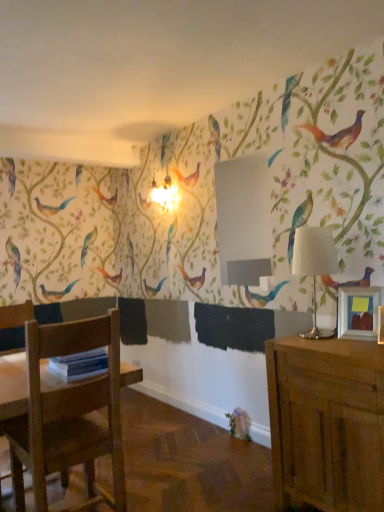
The width and height of the screenshot is (384, 512). I want to click on white fabric lampshade at right, so click(x=314, y=265).

You are a GUI agent. You are given a task and a screenshot of the screen. Output one action in this format:
    pyautogui.click(x=<x>, y=<y>)
    Task: Click on the wooden cabinet at right
    Image resolution: width=384 pixels, height=512 pixels.
    Given the screenshot: What is the action you would take?
    pyautogui.click(x=327, y=422)

Identify the location of wooden picture frame at right. The height and width of the screenshot is (512, 384). (358, 312).

Considering the sizes of wooden cabinet at right and wooden chair at lower left in the image, is wooden cabinet at right wider or thinner than wooden chair at lower left?

Considering their sizes, wooden cabinet at right looks slimmer than wooden chair at lower left.

Is wooden cabinet at right positioned far away from wooden chair at lower left?

wooden cabinet at right is far away from wooden chair at lower left.

The height and width of the screenshot is (512, 384). Identify the location of chair located behind the wooden cabinet at right. (16, 315).

Considering the sizes of objects wooden cabinet at right and wooden chair at lower left in the image provided, who is shorter, wooden cabinet at right or wooden chair at lower left?

wooden cabinet at right is shorter.

Is wooden chair at lower left taller than white fabric lampshade at right?

Correct, wooden chair at lower left is much taller as white fabric lampshade at right.

Identify the location of lamp positioned vertically above the wooden chair at lower left (from a real-world perspective). (314, 265).

From the image's perspective, which is above, wooden chair at lower left or white fabric lampshade at right?

white fabric lampshade at right appears higher in the image.

Is wooden chair at lower left outside of white fabric lampshade at right?

That's correct, wooden chair at lower left is outside of white fabric lampshade at right.

Does wooden picture frame at right have a lesser width compared to wooden chair at lower left?

Yes.

From the picture: Considering the sizes of objects wooden picture frame at right and wooden chair at lower left in the image provided, who is bigger, wooden picture frame at right or wooden chair at lower left?

With larger size is wooden chair at lower left.

How many degrees apart are the facing directions of wooden picture frame at right and wooden chair at lower left?

wooden picture frame at right and wooden chair at lower left are facing 107 degrees away from each other.

Find the location of a particular element. The image size is (384, 512). chair below the wooden picture frame at right (from a real-world perspective) is located at coordinates (16, 315).

Consider the image. Does wooden picture frame at right contain wooden cabinet at right?

No.

Is wooden picture frame at right oriented towards wooden cabinet at right?

No, wooden picture frame at right does not turn towards wooden cabinet at right.

Who is bigger, wooden picture frame at right or wooden cabinet at right?

wooden cabinet at right is bigger.

Considering the positions of point (374, 333) and point (347, 481), is point (374, 333) closer or farther from the camera than point (347, 481)?

Point (374, 333).

From a real-world perspective, is white fabric lampshade at right beneath wooden picture frame at right?

No, from a real-world perspective, white fabric lampshade at right is not under wooden picture frame at right.

Based on their positions, is white fabric lampshade at right located to the left or right of wooden picture frame at right?

white fabric lampshade at right is to the left of wooden picture frame at right.

Does point (306, 249) appear closer or farther from the camera than point (359, 293)?

Point (306, 249).

Does white fabric lampshade at right have a larger size compared to wooden chair at lower left?

Actually, white fabric lampshade at right might be smaller than wooden chair at lower left.

From the image's perspective, is white fabric lampshade at right positioned above or below wooden chair at lower left?

white fabric lampshade at right is situated higher than wooden chair at lower left in the image.

Can you tell me how much white fabric lampshade at right and wooden chair at lower left differ in facing direction?

92.3 degrees separate the facing orientations of white fabric lampshade at right and wooden chair at lower left.

Are white fabric lampshade at right and wooden chair at lower left far apart?

That's right, there is a large distance between white fabric lampshade at right and wooden chair at lower left.

Is wooden chair at lower left not within wooden cabinet at right?

Yes.

Which object is closer to the camera, wooden chair at lower left or wooden cabinet at right?

wooden cabinet at right is in front.

Where is `cabinetry in front of the wooden chair at lower left`? This screenshot has height=512, width=384. cabinetry in front of the wooden chair at lower left is located at coordinates (327, 422).

Is wooden chair at lower left positioned with its back to wooden cabinet at right?

That's not correct — wooden chair at lower left is not looking away from wooden cabinet at right.

This screenshot has height=512, width=384. In order to click on cabinetry lying on the right of wooden chair at lower left in this screenshot , I will do `click(327, 422)`.

Identify the location of lamp behind the wooden chair at lower left. (314, 265).

Estimate the real-world distances between objects in this image. Which object is further from white fabric lampshade at right, wooden chair at lower left or wooden picture frame at right?

wooden chair at lower left is positioned further to the anchor white fabric lampshade at right.

Looking at the image, which one is located closer to wooden picture frame at right, wooden chair at lower left or white fabric lampshade at right?

white fabric lampshade at right is closer to wooden picture frame at right.

Consider the image. Which object lies nearer to the anchor point white fabric lampshade at right, wooden cabinet at right or wooden picture frame at right?

wooden picture frame at right is positioned closer to the anchor white fabric lampshade at right.

Considering their positions, is white fabric lampshade at right positioned further to wooden chair at lower left than wooden picture frame at right?

wooden picture frame at right is positioned further to the anchor wooden chair at lower left.

From the image, which object appears to be farther from white fabric lampshade at right, wooden chair at lower left or wooden cabinet at right?

Based on the image, wooden chair at lower left appears to be further to white fabric lampshade at right.

Looking at this image, looking at the image, which one is located closer to wooden chair at lower left, wooden cabinet at right or wooden picture frame at right?

Among the two, wooden cabinet at right is located nearer to wooden chair at lower left.

Estimate the real-world distances between objects in this image. Which object is closer to wooden cabinet at right, wooden picture frame at right or wooden chair at lower left?

wooden picture frame at right is positioned closer to the anchor wooden cabinet at right.

Based on their spatial positions, is wooden picture frame at right or wooden cabinet at right further from wooden chair at lower left?

The object further to wooden chair at lower left is wooden picture frame at right.

Find the location of a particular element. lamp between wooden chair at lower left and wooden picture frame at right from left to right is located at coordinates (314, 265).

This screenshot has height=512, width=384. Identify the location of cabinetry between wooden chair at lower left and wooden picture frame at right from left to right. (327, 422).

Identify the location of picture frame between white fabric lampshade at right and wooden cabinet at right from top to bottom. (358, 312).

Locate an element on the screen. The height and width of the screenshot is (512, 384). lamp between wooden chair at lower left and wooden cabinet at right is located at coordinates (314, 265).